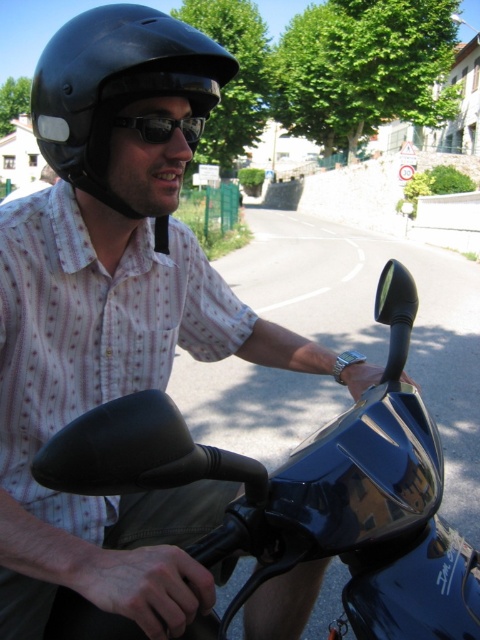
Between point (88, 353) and point (113, 124), which one is positioned in front?

Point (113, 124)

In order to click on white dotted shirt at center in this screenshot , I will do `click(93, 333)`.

Does point (226, 344) lie behind point (163, 132)?

Yes, point (226, 344) is farther from viewer.

Identify the location of white dotted shirt at center. (93, 333).

Who is positioned more to the left, black matte helmet at upper left or black reflective sunglasses at center?

Positioned to the left is black matte helmet at upper left.

From the picture: Can you confirm if black matte helmet at upper left is positioned above black reflective sunglasses at center?

Yes, black matte helmet at upper left is above black reflective sunglasses at center.

What do you see at coordinates (116, 84) in the screenshot? The height and width of the screenshot is (640, 480). I see `black matte helmet at upper left` at bounding box center [116, 84].

Where is `black matte helmet at upper left`? Image resolution: width=480 pixels, height=640 pixels. black matte helmet at upper left is located at coordinates (116, 84).

Which is behind, point (70, 196) or point (200, 77)?

Positioned behind is point (70, 196).

Describe the element at coordinates (93, 333) in the screenshot. I see `white dotted shirt at center` at that location.

You are a GUI agent. You are given a task and a screenshot of the screen. Output one action in this format:
    pyautogui.click(x=<x>, y=<y>)
    Task: Click on the white dotted shirt at center
    The image size is (480, 640).
    Given the screenshot: What is the action you would take?
    pyautogui.click(x=93, y=333)